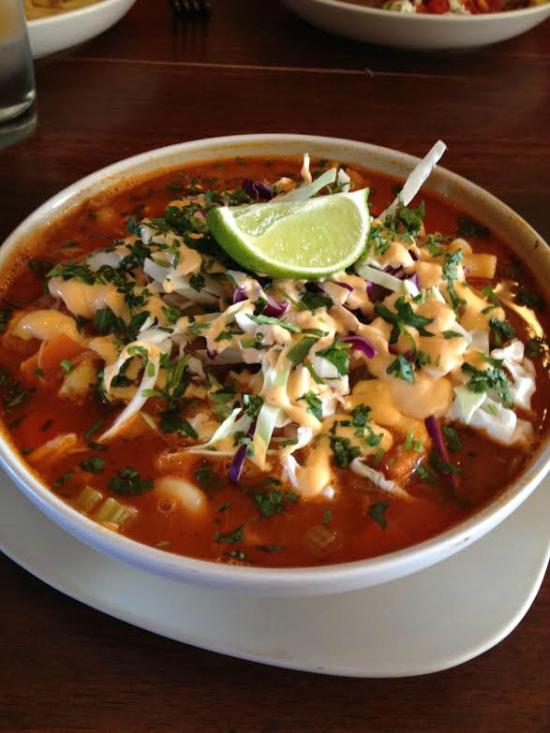
I want to click on bowl, so click(324, 589), click(24, 121).